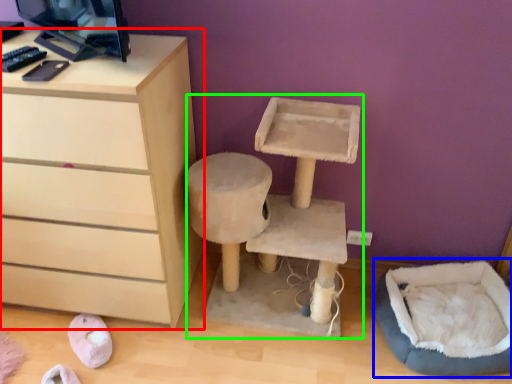
Question: Considering the real-world distances, which object is closest to chest of drawers (highlighted by a red box)? bean bag chair (highlighted by a blue box) or computer desk (highlighted by a green box).

Choices:
 (A) bean bag chair
 (B) computer desk

Answer: (B)